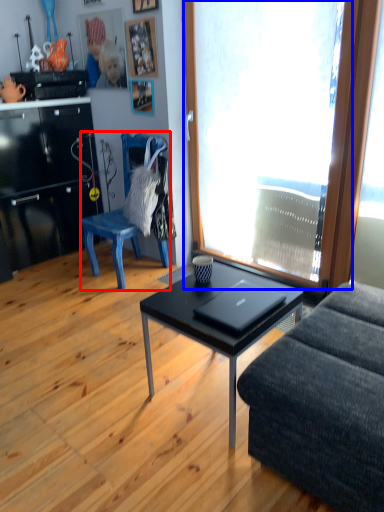
Question: Which object appears farthest to the camera in this image, chair (highlighted by a red box) or window (highlighted by a blue box)?

Choices:
 (A) chair
 (B) window

Answer: (A)